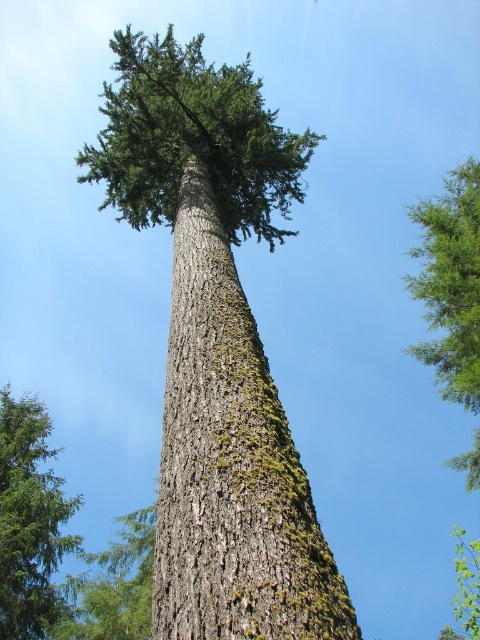
Question: Which object appears farthest from the camera in this image?

Choices:
 (A) green textured leaves at upper right
 (B) green mossy bark at center
 (C) green mossy tree at lower left

Answer: (C)

Question: Is green mossy bark at center smaller than green textured leaves at upper right?

Choices:
 (A) yes
 (B) no

Answer: (A)

Question: Is green mossy tree at lower left smaller than green textured leaves at upper right?

Choices:
 (A) no
 (B) yes

Answer: (B)

Question: Is green mossy bark at center thinner than green textured leaves at upper right?

Choices:
 (A) no
 (B) yes

Answer: (B)

Question: Estimate the real-world distances between objects in this image. Which object is closer to the green mossy tree at lower left?

Choices:
 (A) green textured leaves at upper right
 (B) green mossy bark at center

Answer: (A)

Question: Which point is farther from the camera taking this photo?

Choices:
 (A) (62, 480)
 (B) (153, 611)
 (C) (441, 301)

Answer: (A)